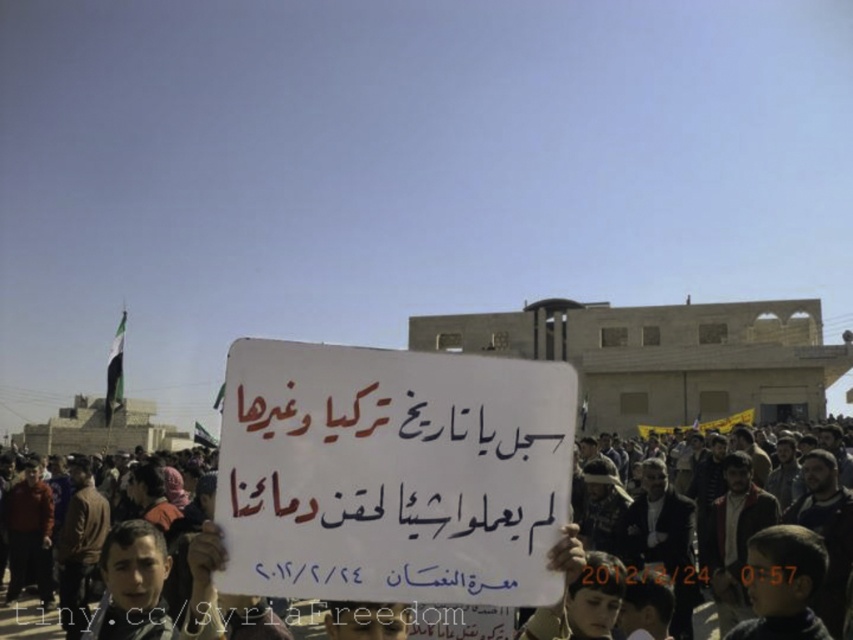
You are a photographer standing in front of the white paper sign at center. You want to take a photo of the sign and the crowd behind it. If your camera has a maximum zoom range of 100 feet, will you be able to capture both the sign and the crowd clearly in one shot?

The distance between you and the white paper sign at center is 120.47 feet, which exceeds the camera maximum zoom range of 100 feet. Therefore, you cannot capture both the sign and the crowd clearly in one shot.

You are a photographer trying to capture the protest scene. You want to ensure both the white paper sign at center and the dark brown leather jacket at center are clearly visible in your photo. Given their sizes, which object should you focus on first to ensure it doesn

The white paper sign at center occupies less space than the dark brown leather jacket at center, so you should focus on the white paper sign at center first to ensure it is clearly visible before the larger object might overshadow it.

You are a photographer trying to capture the protest scene. You notice the white paper sign at center and the dark brown leather jacket at center. Which object is positioned closer to your camera lens?

The white paper sign at center is closer to the viewer than the dark brown leather jacket at center, so the sign will appear closer to the camera lens.